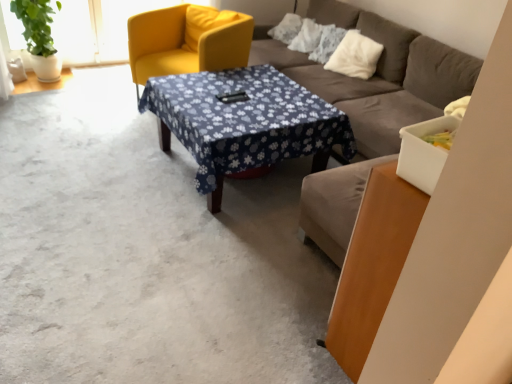
Question: Is matte yellow armchair at upper left bigger than blue floral fabric at center?

Choices:
 (A) no
 (B) yes

Answer: (B)

Question: Is blue floral fabric at center at the back of matte yellow armchair at upper left?

Choices:
 (A) no
 (B) yes

Answer: (A)

Question: Is matte yellow armchair at upper left further to the viewer compared to blue floral fabric at center?

Choices:
 (A) no
 (B) yes

Answer: (B)

Question: Is matte yellow armchair at upper left outside of blue floral fabric at center?

Choices:
 (A) no
 (B) yes

Answer: (B)

Question: Does matte yellow armchair at upper left turn towards blue floral fabric at center?

Choices:
 (A) yes
 (B) no

Answer: (B)

Question: Choose the correct answer: Is brown fabric couch at center inside white fluffy pillow at upper right or outside it?

Choices:
 (A) outside
 (B) inside

Answer: (A)

Question: Relative to white fluffy pillow at upper right, is brown fabric couch at center in front or behind?

Choices:
 (A) front
 (B) behind

Answer: (A)

Question: From a real-world perspective, is brown fabric couch at center positioned above or below white fluffy pillow at upper right?

Choices:
 (A) below
 (B) above

Answer: (A)

Question: Based on their sizes in the image, would you say brown fabric couch at center is bigger or smaller than white fluffy pillow at upper right?

Choices:
 (A) small
 (B) big

Answer: (B)

Question: From a real-world perspective, is blue floral fabric at center physically located above or below white fluffy pillow at upper right?

Choices:
 (A) below
 (B) above

Answer: (A)

Question: From the image's perspective, relative to white fluffy pillow at upper right, is blue floral fabric at center above or below?

Choices:
 (A) below
 (B) above

Answer: (A)

Question: In terms of width, does blue floral fabric at center look wider or thinner when compared to white fluffy pillow at upper right?

Choices:
 (A) thin
 (B) wide

Answer: (B)

Question: Considering the positions of point (240, 112) and point (327, 69), is point (240, 112) closer or farther from the camera than point (327, 69)?

Choices:
 (A) closer
 (B) farther

Answer: (A)

Question: Is white fluffy pillow at upper right bigger or smaller than brown fabric couch at center?

Choices:
 (A) small
 (B) big

Answer: (A)

Question: Which is correct: white fluffy pillow at upper right is inside brown fabric couch at center, or outside of it?

Choices:
 (A) outside
 (B) inside

Answer: (B)